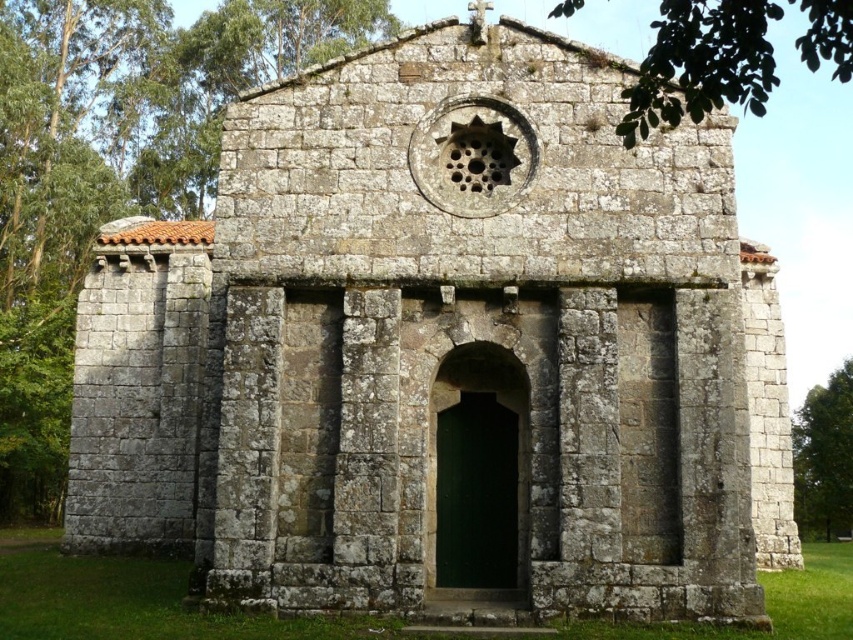
Does green leafy tree at upper center come behind green leafy tree at right?

No, green leafy tree at upper center is in front of green leafy tree at right.

Is green leafy tree at upper center smaller than green leafy tree at right?

No, green leafy tree at upper center is not smaller than green leafy tree at right.

Image resolution: width=853 pixels, height=640 pixels. Identify the location of green leafy tree at upper center. (701, 64).